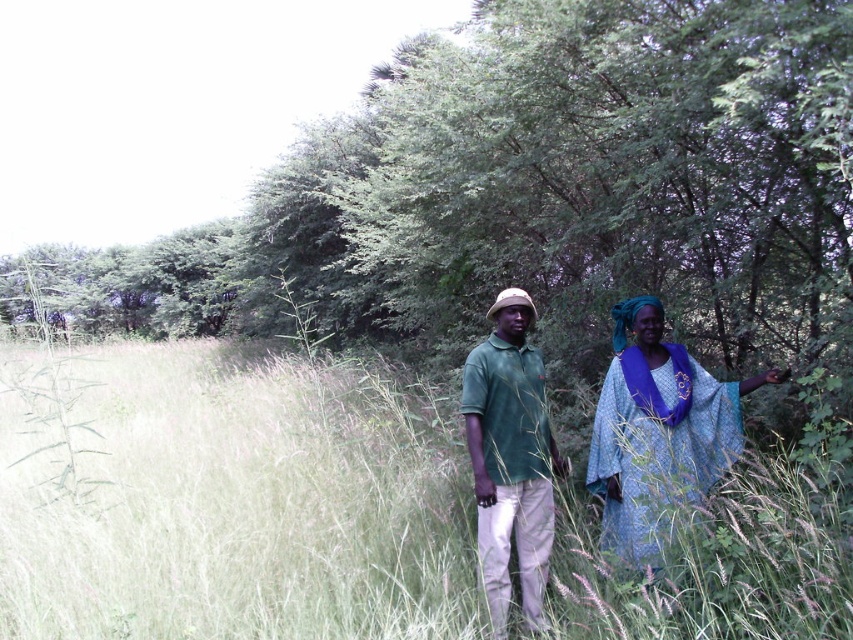
You are a photographer wanting to capture a photo of the green grass at center and the green matte shirt at center in the same frame. Can you fit both subjects into the camera frame if the maximum distance your camera can capture in a single shot is 3 meters?

The distance between the green grass at center and the green matte shirt at center is 3.05 meters, which exceeds the camera frame limit of 3 meters. Therefore, both subjects cannot be captured in the same frame.

Looking at this image, you are standing in the field and want to place a small flag between the green grass at center and the green matte shirt at center. Which object should the flag be placed in front of to ensure it is visible from your current position?

The flag should be placed in front of the green matte shirt at center because the green grass at center is closer to the viewer, so placing the flag in front of the shirt would keep it visible behind the grass.

You are trying to decide which item to take with you for shade from the sun. The blue fabric at right and the green matte shirt at center are both available. Which one would provide more coverage due to its size?

The blue fabric at right is bigger than the green matte shirt at center, so it would provide more coverage for shade from the sun.